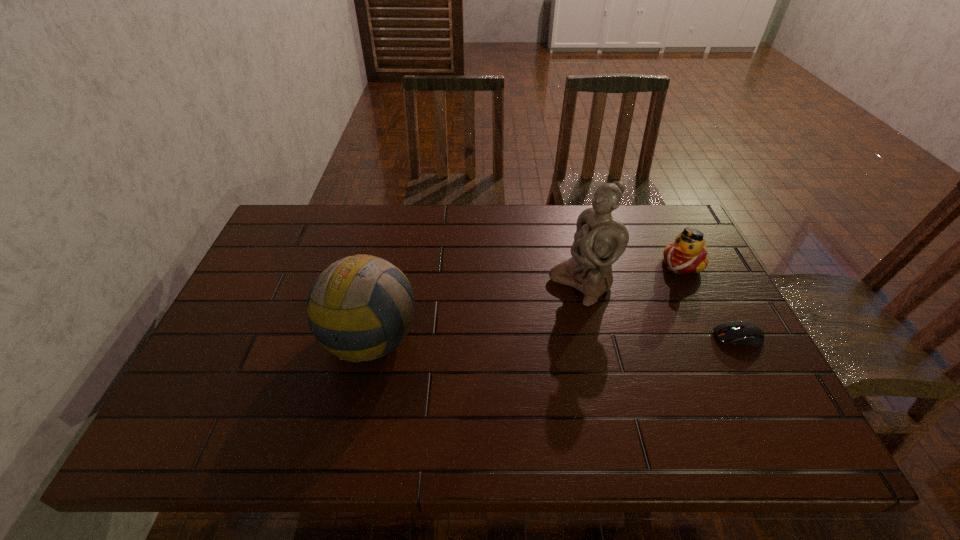
Identify the location of object that is at the far right corner. Image resolution: width=960 pixels, height=540 pixels. (688, 254).

At what (x,y) coordinates should I click in order to perform the action: click on free space at the far edge. Please return your answer as a coordinate pair (x, y). This screenshot has height=540, width=960. Looking at the image, I should click on (410, 216).

This screenshot has height=540, width=960. I want to click on vacant space at the near edge, so click(x=691, y=407).

In the image, there is a desktop. Identify the location of vacant space at the left edge. Image resolution: width=960 pixels, height=540 pixels. (271, 256).

Locate an element on the screen. This screenshot has width=960, height=540. vacant point at the right edge is located at coordinates (708, 325).

You are a GUI agent. You are given a task and a screenshot of the screen. Output one action in this format:
    pyautogui.click(x=<x>, y=<y>)
    Task: Click on the vacant region at the far left corner of the desktop
    The height and width of the screenshot is (540, 960).
    Given the screenshot: What is the action you would take?
    pyautogui.click(x=287, y=222)

Find the location of a particular element. free location at the near left corner of the desktop is located at coordinates (201, 384).

You are a GUI agent. You are given a task and a screenshot of the screen. Output one action in this format:
    pyautogui.click(x=<x>, y=<y>)
    Task: Click on the free space at the near right corner of the desktop
    The width and height of the screenshot is (960, 540).
    Given the screenshot: What is the action you would take?
    pyautogui.click(x=751, y=393)

At what (x,y) coordinates should I click in order to perform the action: click on free space between the volleyball and the third object from right to left. Please return your answer as a coordinate pair (x, y). This screenshot has height=540, width=960. Looking at the image, I should click on (474, 310).

I want to click on unoccupied area between the tallest object and the third tallest object, so click(632, 274).